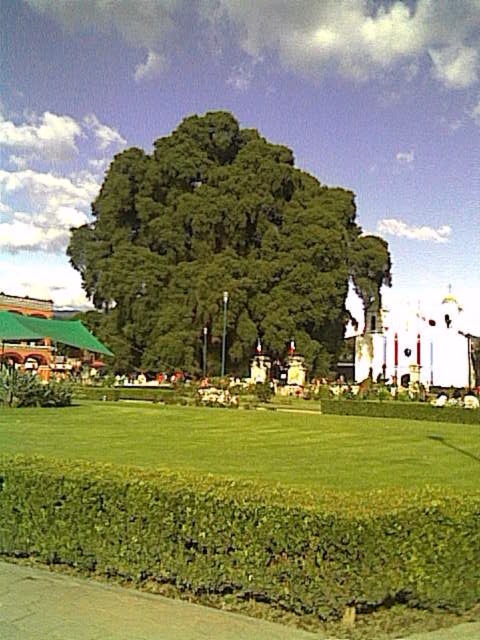
You are planning to place a picnic blanket in the green grass at lower center. Considering the size of the green leafy tree at center, will the picnic blanket fit comfortably without being under the tree?

The green leafy tree at center is wider than the green grass at lower center, so the picnic blanket may not fit comfortably without overlapping into the area under the tree.